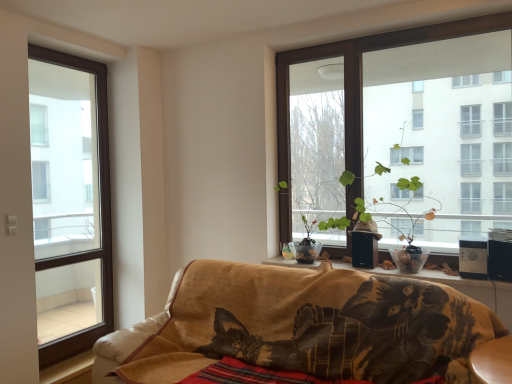
Question: Considering the positions of green matte plant at center and velvet-like brown cat at lower center in the image, is green matte plant at center wider or thinner than velvet-like brown cat at lower center?

Choices:
 (A) thin
 (B) wide

Answer: (A)

Question: From a real-world perspective, is green matte plant at center physically located above or below velvet-like brown cat at lower center?

Choices:
 (A) above
 (B) below

Answer: (A)

Question: Which object is positioned closest to the green matte plant at center?

Choices:
 (A) brown wood window at left, which ranks as the 1th window in left-to-right order
 (B) brown wooden window at upper right, placed as the 2th window when sorted from left to right
 (C) velvet-like brown cat at lower center

Answer: (B)

Question: Based on their relative distances, which object is farther from the velvet-like brown cat at lower center?

Choices:
 (A) brown wood window at left, which ranks as the 1th window in left-to-right order
 (B) green matte plant at center
 (C) brown wooden window at upper right, placed as the 2th window when sorted from left to right

Answer: (A)